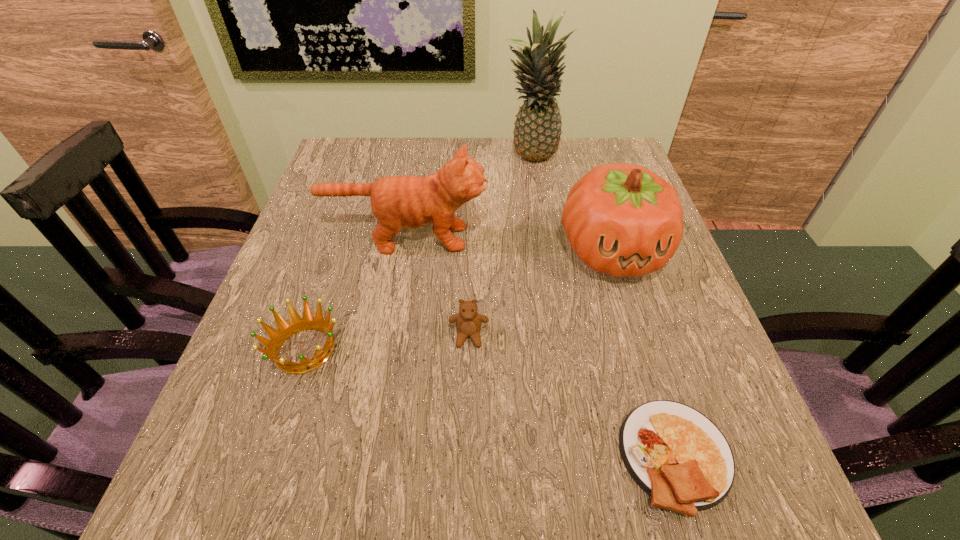
The width and height of the screenshot is (960, 540). Identify the location of object present at the near right corner. (679, 457).

Identify the location of vacant space at the far edge. (562, 166).

You are a GUI agent. You are given a task and a screenshot of the screen. Output one action in this format:
    pyautogui.click(x=<x>, y=<y>)
    Task: Click on the vacant region at the left edge
    This screenshot has width=960, height=540.
    Given the screenshot: What is the action you would take?
    pyautogui.click(x=282, y=379)

In the image, there is a desktop. Find the location of `vacant region at the right edge`. vacant region at the right edge is located at coordinates (673, 318).

At what (x,y) coordinates should I click in order to perform the action: click on free region at the far left corner. Please return your answer as a coordinate pair (x, y). The width and height of the screenshot is (960, 540). Looking at the image, I should click on (346, 156).

Where is `free area in between the pumpkin and the cat`? free area in between the pumpkin and the cat is located at coordinates (509, 245).

Locate an element on the screen. vacant space that's between the cat and the pumpkin is located at coordinates (509, 245).

Image resolution: width=960 pixels, height=540 pixels. Identify the location of free space between the second shortest object and the cat. tap(355, 294).

This screenshot has width=960, height=540. I want to click on vacant area that lies between the second shortest object and the cat, so click(355, 294).

Locate an element on the screen. free point between the omelet and the cat is located at coordinates (541, 347).